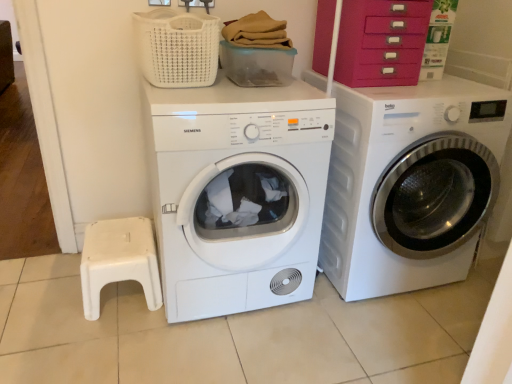
Question: Is white plastic step stool at lower left oriented towards white glossy washing machine at right, which appears as the 1th washing machine when viewed from the right?

Choices:
 (A) no
 (B) yes

Answer: (A)

Question: From a real-world perspective, is white plastic step stool at lower left positioned under white glossy washing machine at right, which appears as the 1th washing machine when viewed from the right, based on gravity?

Choices:
 (A) no
 (B) yes

Answer: (B)

Question: Is white plastic step stool at lower left outside of white glossy washing machine at right, which appears as the 1th washing machine when viewed from the right?

Choices:
 (A) no
 (B) yes

Answer: (B)

Question: From a real-world perspective, is white plastic step stool at lower left on top of white glossy washing machine at right, placed as the 2th washing machine when sorted from left to right?

Choices:
 (A) yes
 (B) no

Answer: (B)

Question: Is white plastic step stool at lower left at the right side of white glossy washing machine at right, which appears as the 1th washing machine when viewed from the right?

Choices:
 (A) yes
 (B) no

Answer: (B)

Question: Looking at the image, does velvet pink drawer at upper right seem bigger or smaller compared to white woven basket at upper center?

Choices:
 (A) small
 (B) big

Answer: (B)

Question: Does point (412, 44) appear closer or farther from the camera than point (202, 29)?

Choices:
 (A) farther
 (B) closer

Answer: (A)

Question: Considering the relative positions of velvet pink drawer at upper right and white woven basket at upper center in the image provided, is velvet pink drawer at upper right to the left or to the right of white woven basket at upper center?

Choices:
 (A) right
 (B) left

Answer: (A)

Question: Is velvet pink drawer at upper right in front of or behind white woven basket at upper center in the image?

Choices:
 (A) front
 (B) behind

Answer: (B)

Question: Is white woven basket at upper center in front of or behind white plastic step stool at lower left in the image?

Choices:
 (A) behind
 (B) front

Answer: (B)

Question: Based on their positions, is white woven basket at upper center located to the left or right of white plastic step stool at lower left?

Choices:
 (A) right
 (B) left

Answer: (A)

Question: Looking at their shapes, would you say white woven basket at upper center is wider or thinner than white plastic step stool at lower left?

Choices:
 (A) thin
 (B) wide

Answer: (B)

Question: Is white woven basket at upper center bigger or smaller than white plastic step stool at lower left?

Choices:
 (A) small
 (B) big

Answer: (B)

Question: Is white glossy washing machine at right, which appears as the 1th washing machine when viewed from the right, spatially inside white matte dryer at center, positioned as the second washing machine in right-to-left order, or outside of it?

Choices:
 (A) inside
 (B) outside

Answer: (B)

Question: Is white glossy washing machine at right, placed as the 2th washing machine when sorted from left to right, in front of or behind white matte dryer at center, positioned as the second washing machine in right-to-left order, in the image?

Choices:
 (A) front
 (B) behind

Answer: (B)